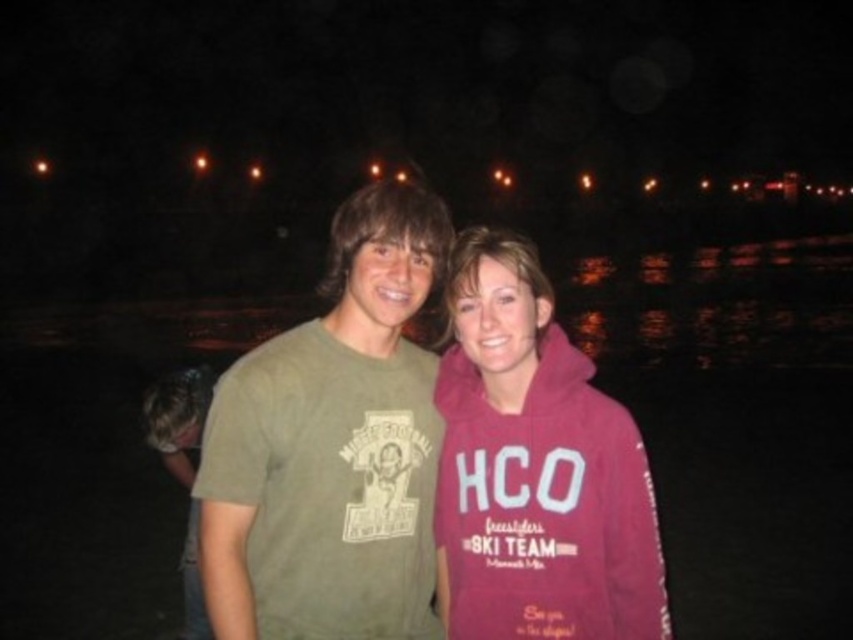
Question: Can you confirm if pink fleece sweatshirt at center is smaller than green matte t-shirt at lower left?

Choices:
 (A) yes
 (B) no

Answer: (A)

Question: Can you confirm if green cotton t-shirt at center is bigger than pink fleece sweatshirt at center?

Choices:
 (A) yes
 (B) no

Answer: (A)

Question: Does pink fleece sweatshirt at center appear on the left side of green matte t-shirt at lower left?

Choices:
 (A) no
 (B) yes

Answer: (A)

Question: Which point appears farthest from the camera in this image?

Choices:
 (A) (579, 440)
 (B) (175, 448)
 (C) (247, 420)

Answer: (B)

Question: Among these objects, which one is nearest to the camera?

Choices:
 (A) pink fleece sweatshirt at center
 (B) green matte t-shirt at lower left

Answer: (A)

Question: Which point is closer to the camera?

Choices:
 (A) (190, 627)
 (B) (641, 634)
 (C) (282, 474)

Answer: (B)